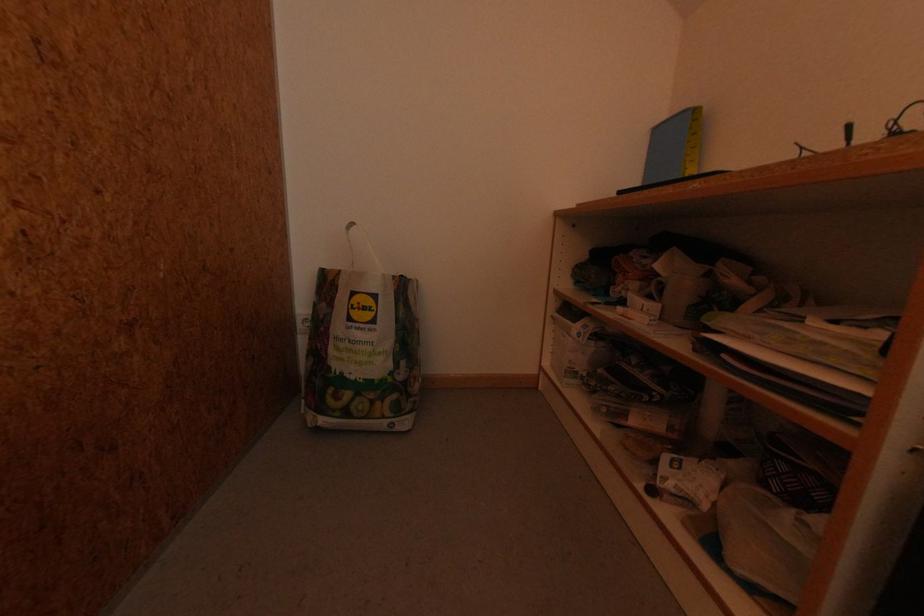
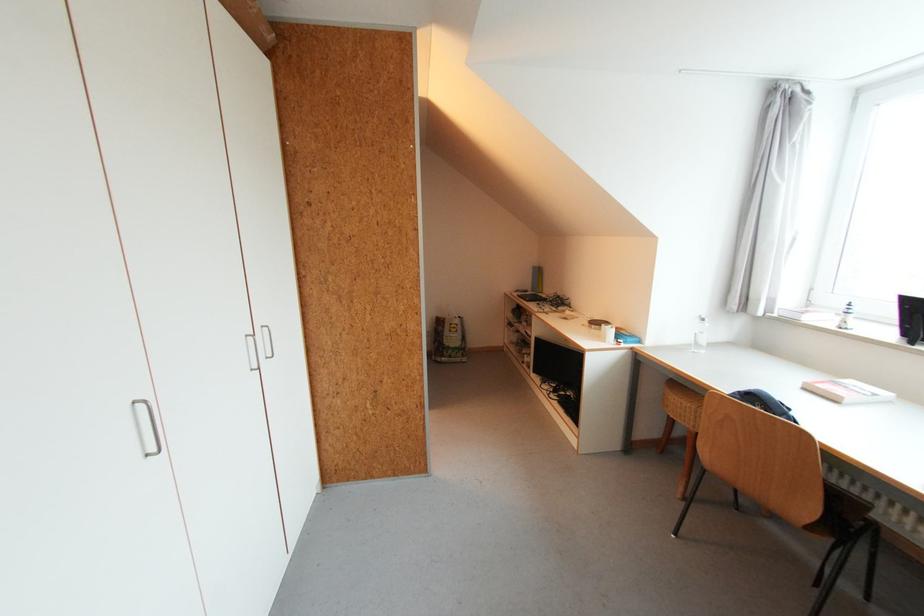
Question: The images are taken continuously from a first-person perspective. In which direction are you moving?

Choices:
 (A) Left
 (B) Right
 (C) Forward
 (D) Backward

Answer: (D)